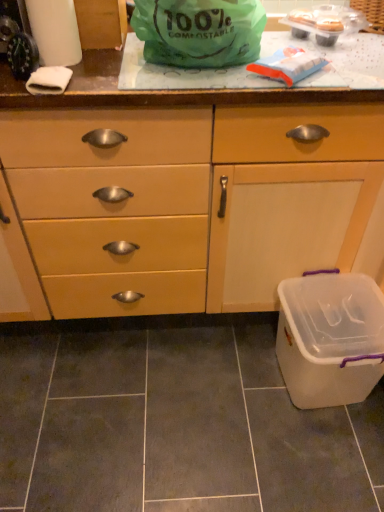
Identify the location of unoccupied region to the right of white paper towel at upper left. (106, 69).